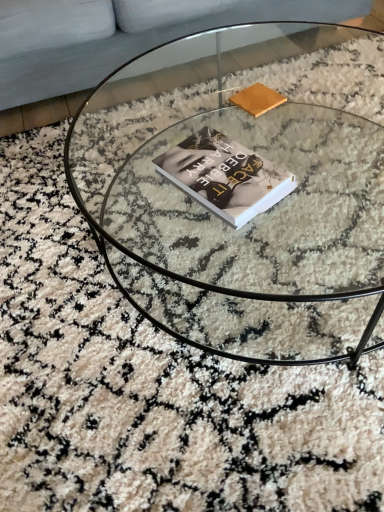
Find the location of a particular element. vacant area that is in front of matte brown book at upper center is located at coordinates (265, 134).